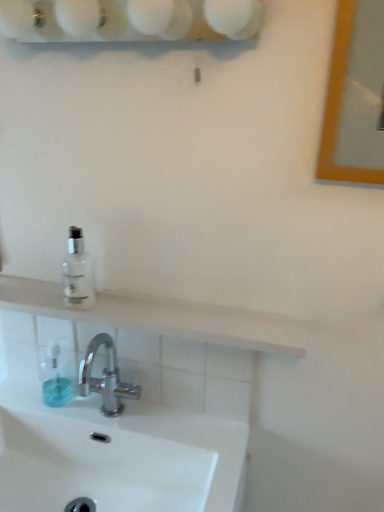
What are the coordinates of `vacant space in white glossy shelf at upper center (from a real-world perspective)` in the screenshot? It's located at (139, 304).